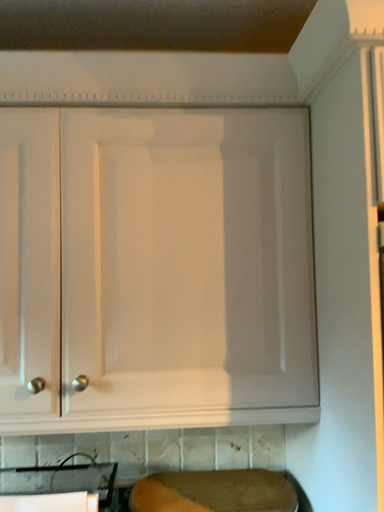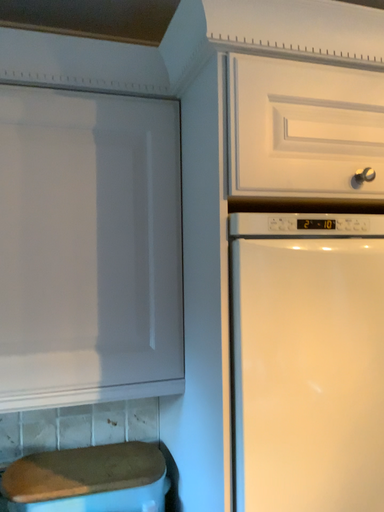
Question: How did the camera likely rotate when shooting the video?

Choices:
 (A) rotated left
 (B) rotated right

Answer: (B)